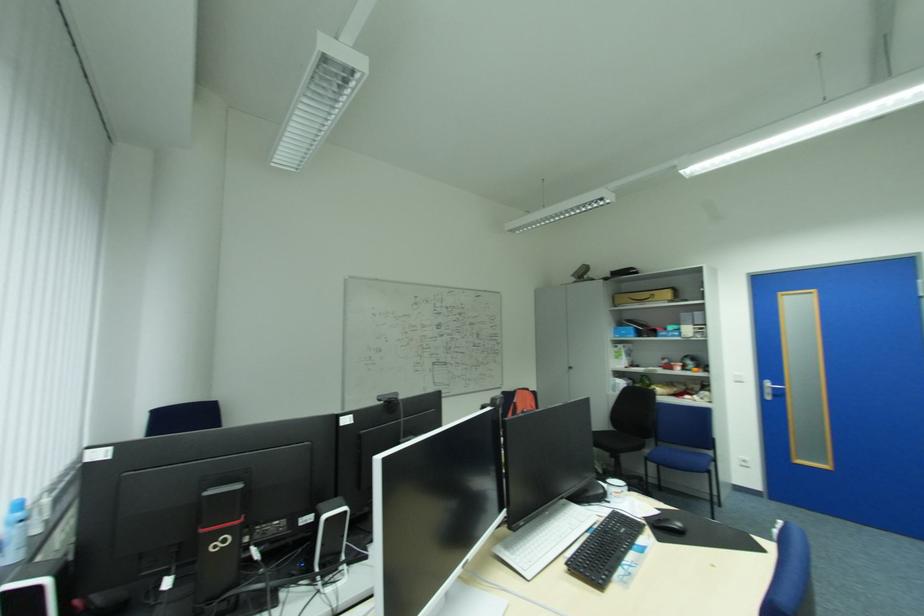
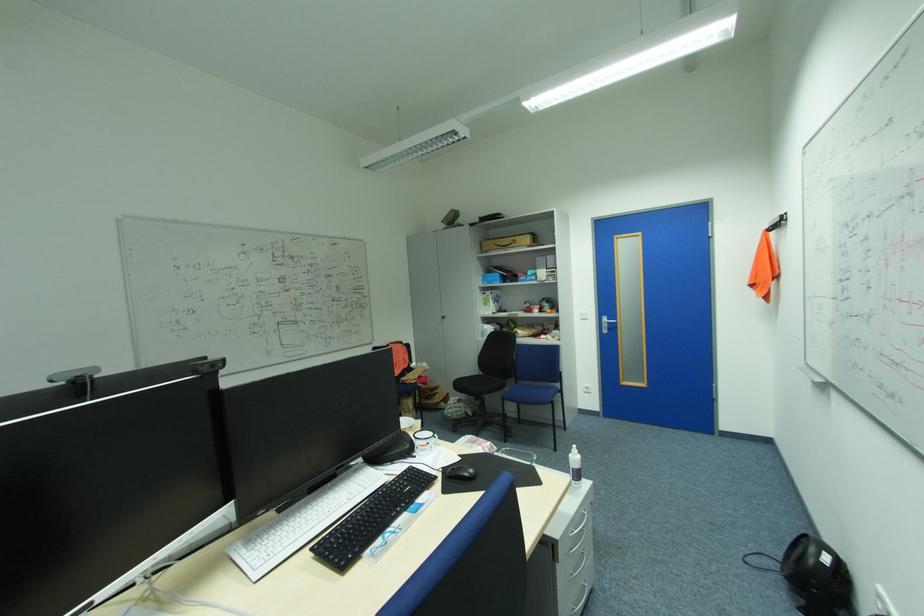
The images are taken continuously from a first-person perspective. In which direction are you moving?

The cameraman walked toward right, forward.